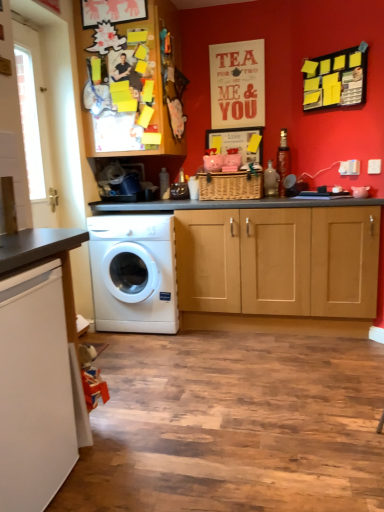
Question: Is white glossy washing machine at center at the back of yellow sticky notes on black board at upper right?

Choices:
 (A) yes
 (B) no

Answer: (B)

Question: Can you confirm if yellow sticky notes on black board at upper right is smaller than white glossy washing machine at center?

Choices:
 (A) yes
 (B) no

Answer: (A)

Question: From a real-world perspective, is yellow sticky notes on black board at upper right located higher than white glossy washing machine at center?

Choices:
 (A) no
 (B) yes

Answer: (B)

Question: From the image's perspective, is yellow sticky notes on black board at upper right located beneath white glossy washing machine at center?

Choices:
 (A) yes
 (B) no

Answer: (B)

Question: Is yellow sticky notes on black board at upper right wider than white glossy washing machine at center?

Choices:
 (A) yes
 (B) no

Answer: (B)

Question: From a real-world perspective, is wooden cabinet at upper left positioned above or below white glossy countertop at lower left?

Choices:
 (A) above
 (B) below

Answer: (A)

Question: Considering the positions of point (115, 88) and point (18, 258), is point (115, 88) closer or farther from the camera than point (18, 258)?

Choices:
 (A) farther
 (B) closer

Answer: (A)

Question: Looking at the image, does wooden cabinet at upper left seem bigger or smaller compared to white glossy countertop at lower left?

Choices:
 (A) small
 (B) big

Answer: (B)

Question: Is wooden cabinet at upper left wider or thinner than white glossy countertop at lower left?

Choices:
 (A) thin
 (B) wide

Answer: (B)

Question: Based on their positions, is white glossy washing machine at center located to the left or right of white glossy countertop at lower left?

Choices:
 (A) right
 (B) left

Answer: (A)

Question: Does point (173, 221) appear closer or farther from the camera than point (36, 500)?

Choices:
 (A) closer
 (B) farther

Answer: (B)

Question: In terms of height, does white glossy washing machine at center look taller or shorter compared to white glossy countertop at lower left?

Choices:
 (A) short
 (B) tall

Answer: (B)

Question: Looking at their shapes, would you say white glossy washing machine at center is wider or thinner than white glossy countertop at lower left?

Choices:
 (A) thin
 (B) wide

Answer: (A)

Question: From the image's perspective, is white glossy countertop at lower left located above or below white glossy washing machine at center?

Choices:
 (A) above
 (B) below

Answer: (B)

Question: Is white glossy countertop at lower left to the left or to the right of white glossy washing machine at center in the image?

Choices:
 (A) left
 (B) right

Answer: (A)